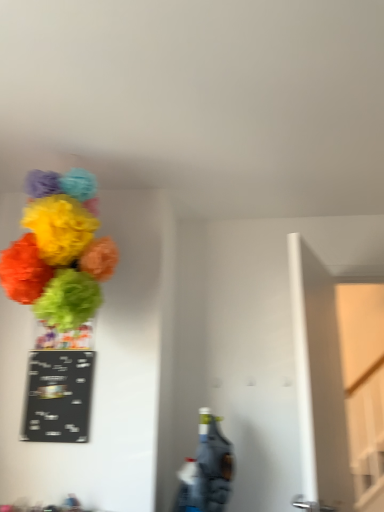
Question: Considering the relative sizes of black chalkboard at left and bright paper pom-poms at upper left in the image provided, is black chalkboard at left smaller than bright paper pom-poms at upper left?

Choices:
 (A) yes
 (B) no

Answer: (A)

Question: Would you say black chalkboard at left is a long distance from bright paper pom-poms at upper left?

Choices:
 (A) yes
 (B) no

Answer: (B)

Question: Is bright paper pom-poms at upper left surrounded by black chalkboard at left?

Choices:
 (A) no
 (B) yes

Answer: (A)

Question: From a real-world perspective, is black chalkboard at left on top of bright paper pom-poms at upper left?

Choices:
 (A) no
 (B) yes

Answer: (A)

Question: Can you confirm if black chalkboard at left is thinner than bright paper pom-poms at upper left?

Choices:
 (A) no
 (B) yes

Answer: (B)

Question: Is point (29, 372) positioned closer to the camera than point (86, 258)?

Choices:
 (A) farther
 (B) closer

Answer: (A)

Question: Looking at their shapes, would you say black chalkboard at left is wider or thinner than bright paper pom-poms at upper left?

Choices:
 (A) wide
 (B) thin

Answer: (B)

Question: In the image, is black chalkboard at left positioned in front of or behind bright paper pom-poms at upper left?

Choices:
 (A) behind
 (B) front

Answer: (A)

Question: Visually, is black chalkboard at left positioned to the left or to the right of bright paper pom-poms at upper left?

Choices:
 (A) left
 (B) right

Answer: (A)

Question: From the image's perspective, is black chalkboard at left above or below green matte vase at upper left?

Choices:
 (A) below
 (B) above

Answer: (A)

Question: Looking at the image, does black chalkboard at left seem bigger or smaller compared to green matte vase at upper left?

Choices:
 (A) big
 (B) small

Answer: (A)

Question: Considering the relative positions of black chalkboard at left and green matte vase at upper left in the image provided, is black chalkboard at left to the left or to the right of green matte vase at upper left?

Choices:
 (A) left
 (B) right

Answer: (B)

Question: Is black chalkboard at left taller or shorter than green matte vase at upper left?

Choices:
 (A) tall
 (B) short

Answer: (A)

Question: Considering the relative positions of bright paper pom-poms at upper left and green matte vase at upper left in the image provided, is bright paper pom-poms at upper left to the left or to the right of green matte vase at upper left?

Choices:
 (A) left
 (B) right

Answer: (B)

Question: Would you say bright paper pom-poms at upper left is inside or outside green matte vase at upper left?

Choices:
 (A) inside
 (B) outside

Answer: (B)